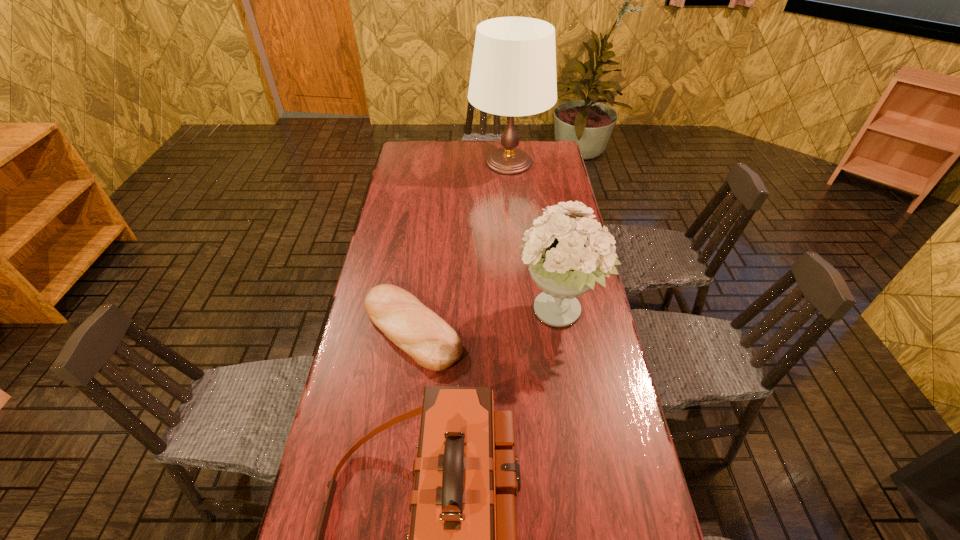
Identify which object is located as the third nearest to the second tallest object. Please provide its 2D coordinates. Your answer should be formatted as a tuple, i.e. [(x, y)], where the tuple contains the x and y coordinates of a point satisfying the conditions above.

[(513, 73)]